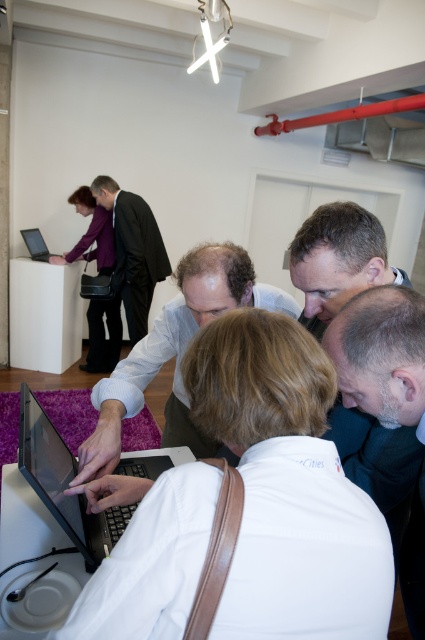
Question: Is matte black suit at upper left wider than matte black laptop at upper left?

Choices:
 (A) no
 (B) yes

Answer: (B)

Question: Which point is closer to the camera?

Choices:
 (A) matte black suit at upper left
 (B) matte black laptop at center

Answer: (B)

Question: Does matte black suit at upper left have a greater width compared to matte black laptop at left?

Choices:
 (A) no
 (B) yes

Answer: (B)

Question: Estimate the real-world distances between objects in this image. Which object is closer to the light blue shirt at center?

Choices:
 (A) matte black suit at upper left
 (B) white fabric shirt at center
 (C) matte black laptop at left
 (D) matte black laptop at upper left

Answer: (B)

Question: Does light blue shirt at center have a larger size compared to matte black laptop at upper left?

Choices:
 (A) no
 (B) yes

Answer: (B)

Question: Which object is closer to the camera taking this photo?

Choices:
 (A) matte black suit at upper left
 (B) matte black laptop at left
 (C) white fabric shirt at center
 (D) matte black laptop at center

Answer: (C)